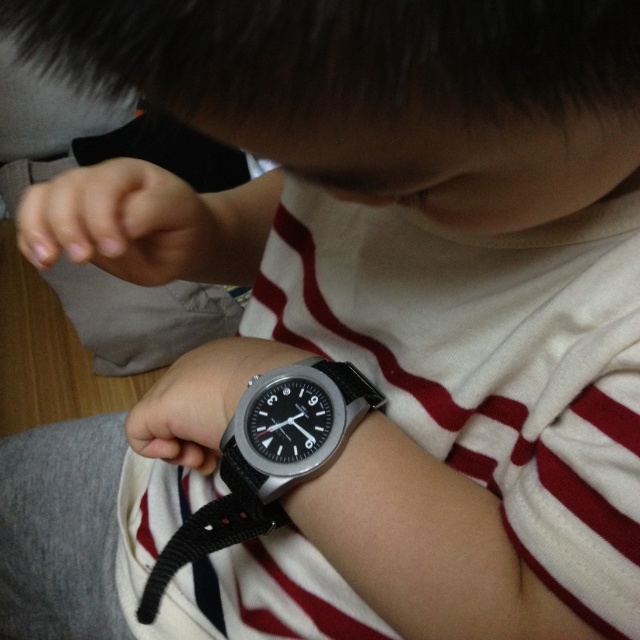
Who is higher up, black nylon strap at wrist or matte skin hand at lower left?

matte skin hand at lower left is above.

In the scene shown: Between black nylon strap at wrist and matte skin hand at lower left, which one appears on the right side from the viewer's perspective?

Positioned to the right is black nylon strap at wrist.

Is point (262, 406) farther from viewer compared to point (128, 163)?

That is False.

Find the location of a particular element. black nylon strap at wrist is located at coordinates (268, 460).

Does point (100, 208) lie in front of point (275, 408)?

That is True.

Between point (124, 196) and point (301, 429), which one is positioned in front?

Point (301, 429) is more forward.

The image size is (640, 640). In order to click on matte skin hand at lower left in this screenshot , I will do `click(118, 221)`.

Which is behind, point (364, 416) or point (196, 385)?

The point (196, 385) is behind.

Is black nylon strap at wrist to the right of black rubber watch at lower center from the viewer's perspective?

A: Indeed, black nylon strap at wrist is positioned on the right side of black rubber watch at lower center.

This screenshot has width=640, height=640. Find the location of `black nylon strap at wrist`. black nylon strap at wrist is located at coordinates (268, 460).